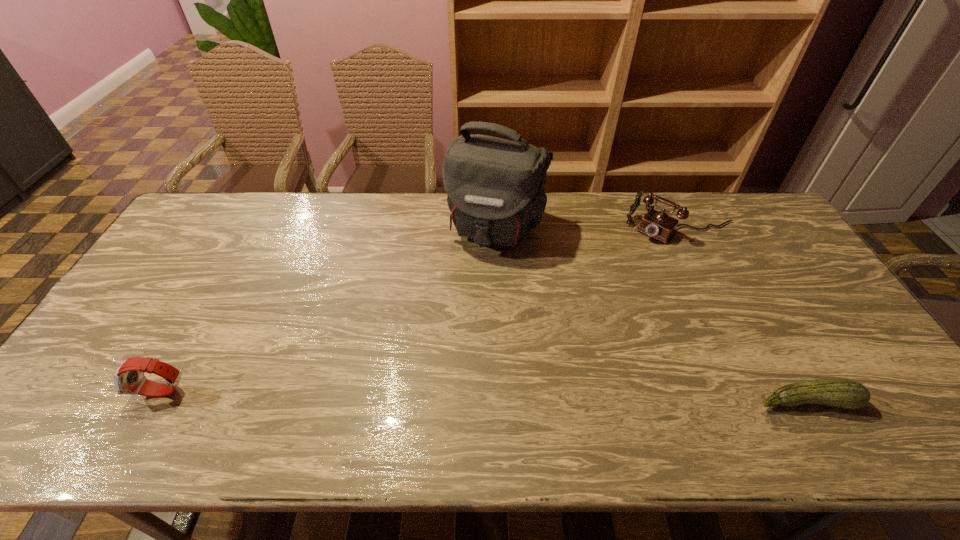
Locate an element on the screen. the leftmost object is located at coordinates (129, 378).

The height and width of the screenshot is (540, 960). Identify the location of the shortest object. (845, 393).

The width and height of the screenshot is (960, 540). Find the location of `shoulder bag`. shoulder bag is located at coordinates (494, 186).

Find the location of a particular element. the tallest object is located at coordinates (494, 186).

Where is `telephone`? The height and width of the screenshot is (540, 960). telephone is located at coordinates (657, 224).

Where is `vacant area situated on the face of the leftmost object`? The width and height of the screenshot is (960, 540). vacant area situated on the face of the leftmost object is located at coordinates (76, 392).

The width and height of the screenshot is (960, 540). Identify the location of free space located 0.110m on the open flap of the tallest object. (471, 284).

Where is `free space located 0.260m on the open flap of the tallest object`? The height and width of the screenshot is (540, 960). free space located 0.260m on the open flap of the tallest object is located at coordinates (455, 322).

Identify the location of vacant space located 0.210m on the open flap of the tallest object. Image resolution: width=960 pixels, height=540 pixels. (461, 308).

Find the location of a particular element. The width and height of the screenshot is (960, 540). vacant point located 0.390m on the dial of the telephone is located at coordinates (587, 310).